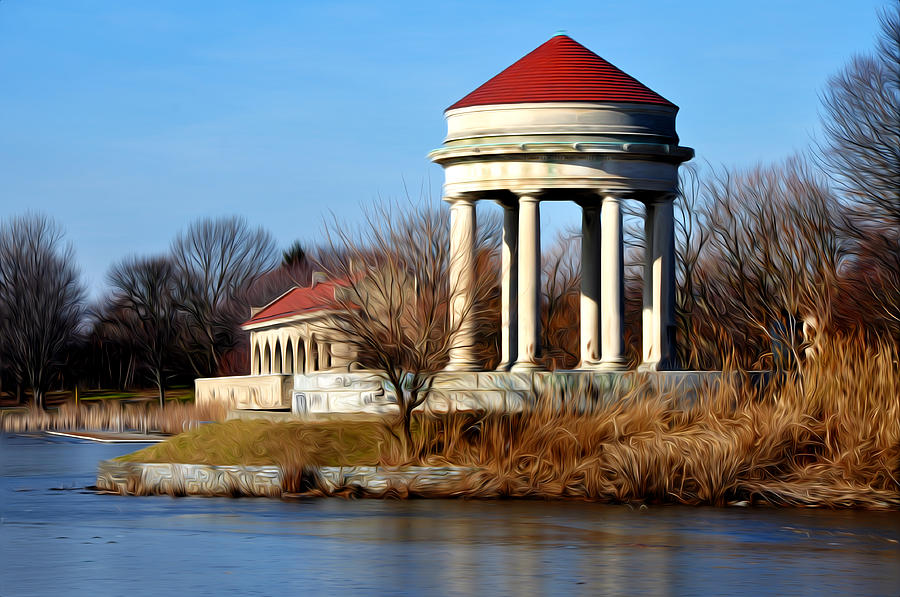
Locate an element on the screen. This screenshot has height=597, width=900. columns is located at coordinates (519, 341), (616, 338), (659, 340), (588, 332), (507, 332), (462, 332).